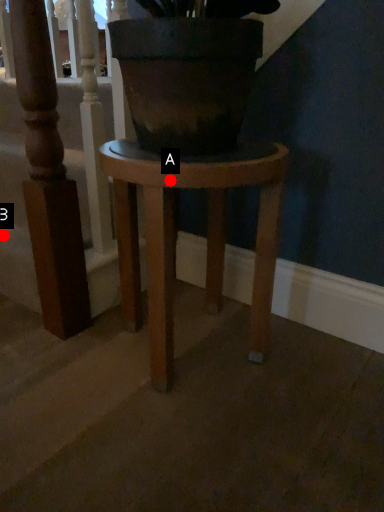
Question: Two points are circled on the image, labeled by A and B beside each circle. Which of the following is the closest to the observer?

Choices:
 (A) A is closer
 (B) B is closer

Answer: (A)